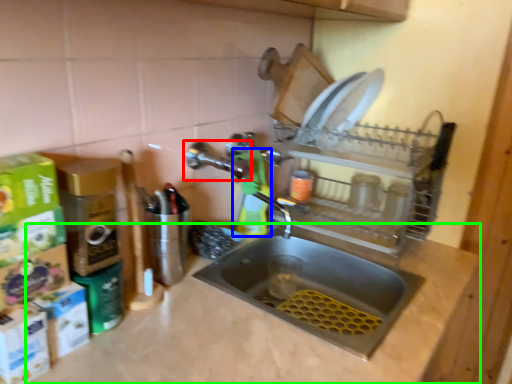
Question: Considering the real-world distances, which object is closest to tap (highlighted by a red box)? cleaning product (highlighted by a blue box) or counter top (highlighted by a green box).

Choices:
 (A) cleaning product
 (B) counter top

Answer: (A)